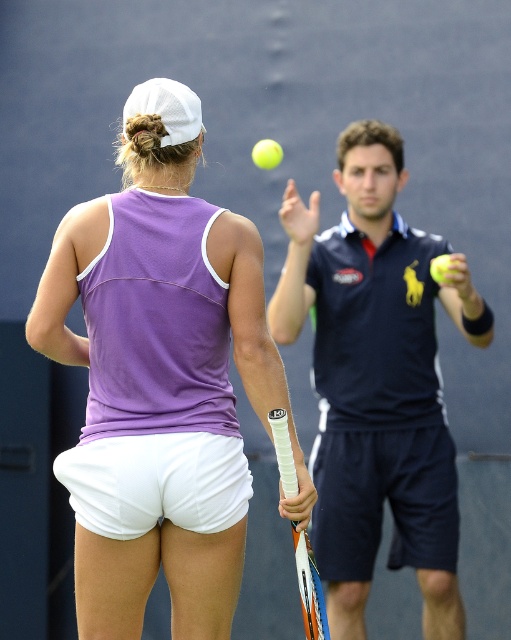
You are a tennis instructor observing the practice session. You notice the purple fabric tennis outfit at center and the white textured grip at lower center. Which object would you estimate to be bigger in size?

The purple fabric tennis outfit at center has a larger size compared to the white textured grip at lower center, so the purple fabric tennis outfit at center is bigger.

You are a tennis coach observing a practice session. You notice two individuals wearing the purple fabric tennis outfit at center and the dark blue polo shirt at center. Which person is wearing clothing with a smaller size?

The purple fabric tennis outfit at center has a smaller size compared to the dark blue polo shirt at center, so the person wearing the purple fabric tennis outfit at center is wearing clothing with a smaller size.